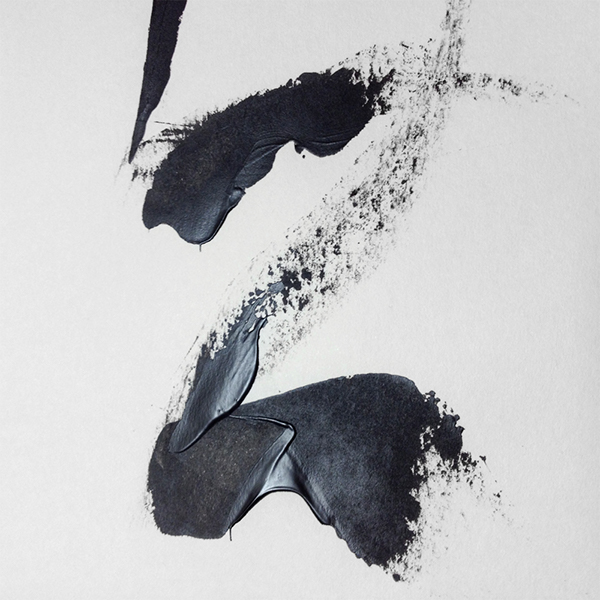
Find the location of a particular element. The image size is (600, 600). left side of black painting is located at coordinates (58, 276).